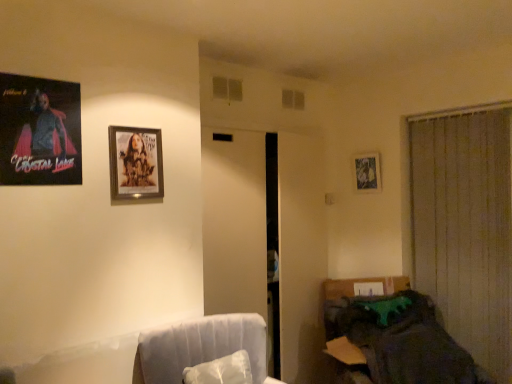
Question: Considering the relative positions of beige fabric curtain at right and wooden frame at upper center, the second picture frame from the left, in the image provided, is beige fabric curtain at right to the left of wooden frame at upper center, the second picture frame from the left, from the viewer's perspective?

Choices:
 (A) no
 (B) yes

Answer: (A)

Question: Does beige fabric curtain at right have a greater width compared to wooden frame at upper center, the second picture frame from the left?

Choices:
 (A) no
 (B) yes

Answer: (B)

Question: Considering the relative sizes of beige fabric curtain at right and wooden frame at upper center, the 2th picture frame from the right, in the image provided, is beige fabric curtain at right smaller than wooden frame at upper center, the 2th picture frame from the right,?

Choices:
 (A) yes
 (B) no

Answer: (B)

Question: From the image's perspective, would you say beige fabric curtain at right is positioned over wooden frame at upper center, the 2th picture frame in the front-to-back sequence?

Choices:
 (A) yes
 (B) no

Answer: (B)

Question: Is beige fabric curtain at right touching wooden frame at upper center, the second picture frame from the left?

Choices:
 (A) yes
 (B) no

Answer: (B)

Question: Would you say beige fabric curtain at right is outside wooden frame at upper center, the second picture frame when ordered from back to front?

Choices:
 (A) yes
 (B) no

Answer: (A)

Question: Is wooden frame at upper center, the 2th picture frame in the front-to-back sequence, at the right side of beige fabric curtain at right?

Choices:
 (A) no
 (B) yes

Answer: (A)

Question: Does wooden frame at upper center, the 2th picture frame in the front-to-back sequence, have a greater height compared to beige fabric curtain at right?

Choices:
 (A) no
 (B) yes

Answer: (A)

Question: Is beige fabric curtain at right surrounded by wooden frame at upper center, the 2th picture frame in the front-to-back sequence?

Choices:
 (A) yes
 (B) no

Answer: (B)

Question: Are wooden frame at upper center, the second picture frame when ordered from back to front, and beige fabric curtain at right far apart?

Choices:
 (A) no
 (B) yes

Answer: (B)

Question: Is wooden frame at upper center, the second picture frame when ordered from back to front, further to the viewer compared to beige fabric curtain at right?

Choices:
 (A) yes
 (B) no

Answer: (B)

Question: Does wooden frame at upper center, the second picture frame from the left, have a greater width compared to beige fabric curtain at right?

Choices:
 (A) yes
 (B) no

Answer: (B)

Question: Does metallic silver picture frame at upper right, the 1th picture frame when ordered from back to front, have a greater width compared to matte black poster at upper left, arranged as the first picture frame when viewed from the left?

Choices:
 (A) yes
 (B) no

Answer: (A)